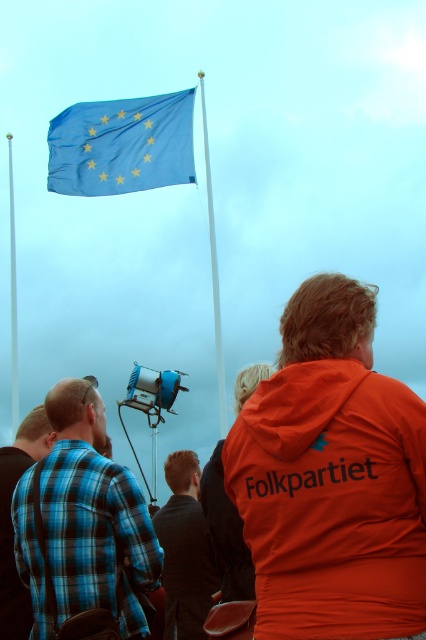
You are a photographer trying to capture the blue fabric flag at upper center and the white plastic flag pole at upper center in a single shot. Given their sizes, which object should you focus on first to ensure both are clearly visible in your photo?

The blue fabric flag at upper center has a smaller size compared to the white plastic flag pole at upper center. To ensure both are clearly visible, focus on the larger white plastic flag pole at upper center first, then adjust the framing to include the smaller blue fabric flag at upper center.